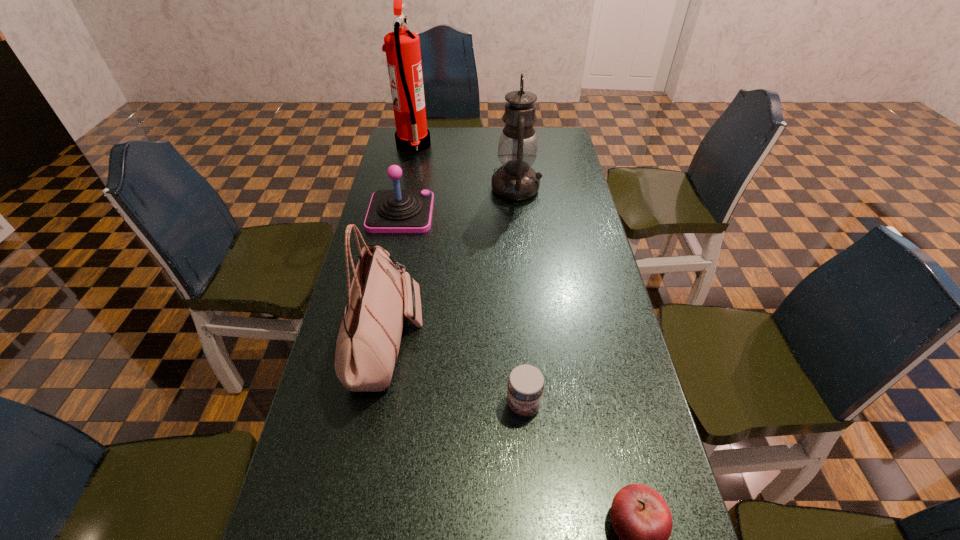
Image resolution: width=960 pixels, height=540 pixels. Find the location of `free space located 0.200m on the front label of the jam`. free space located 0.200m on the front label of the jam is located at coordinates (532, 521).

You are a GUI agent. You are given a task and a screenshot of the screen. Output one action in this format:
    pyautogui.click(x=<x>, y=<y>)
    Task: Click on the object located in the far edge section of the desktop
    Image resolution: width=960 pixels, height=540 pixels.
    Given the screenshot: What is the action you would take?
    pyautogui.click(x=402, y=47)

The height and width of the screenshot is (540, 960). Find the location of `fire extinguisher at the left edge`. fire extinguisher at the left edge is located at coordinates (402, 47).

Identify the location of handbag located in the left edge section of the desktop. (368, 343).

Where is `joystick that is positioned at the left edge`? Image resolution: width=960 pixels, height=540 pixels. joystick that is positioned at the left edge is located at coordinates (390, 211).

This screenshot has width=960, height=540. Identify the location of object situated at the right edge. (515, 180).

Identify the location of object at the far left corner. (402, 47).

I want to click on vacant space at the far edge of the desktop, so click(x=462, y=154).

I want to click on vacant space at the left edge of the desktop, so [x=364, y=394].

Identify the location of vacant area at the right edge of the desktop. (566, 272).